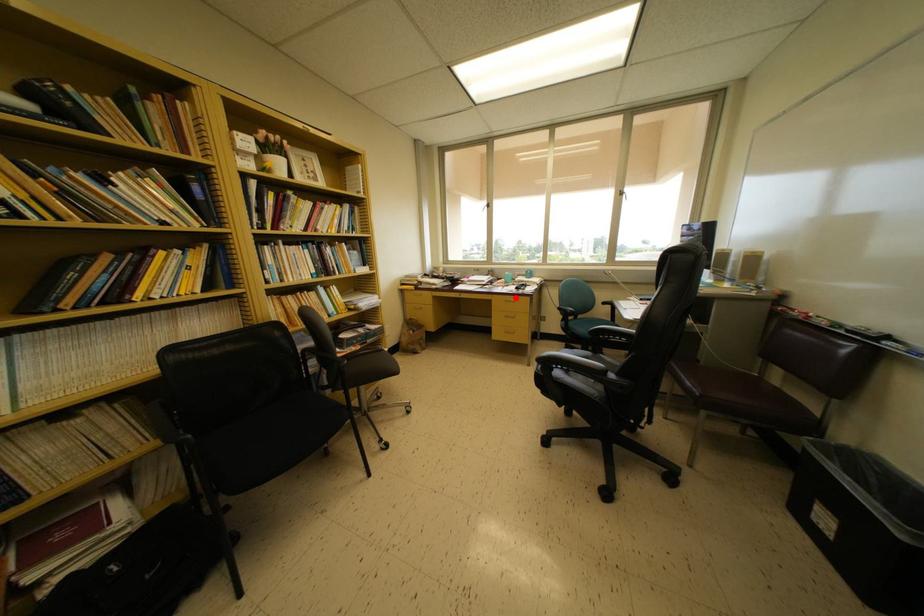
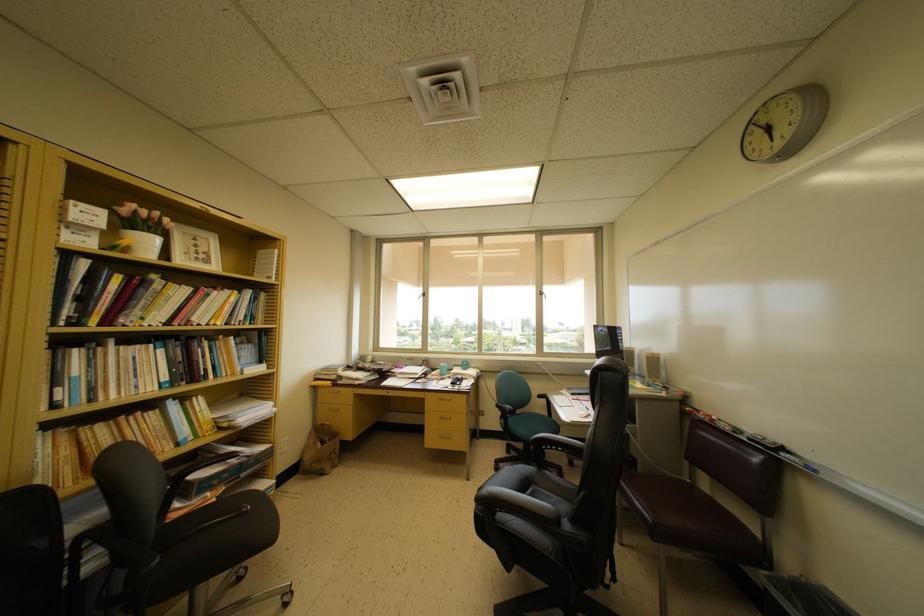
Question: I am providing you with two images of the same scene from different viewpoints. Given a red point in image1, look at the same physical point in image2. Is it:

Choices:
 (A) Closer to the viewpoint
 (B) Farther from the viewpoint

Answer: (B)